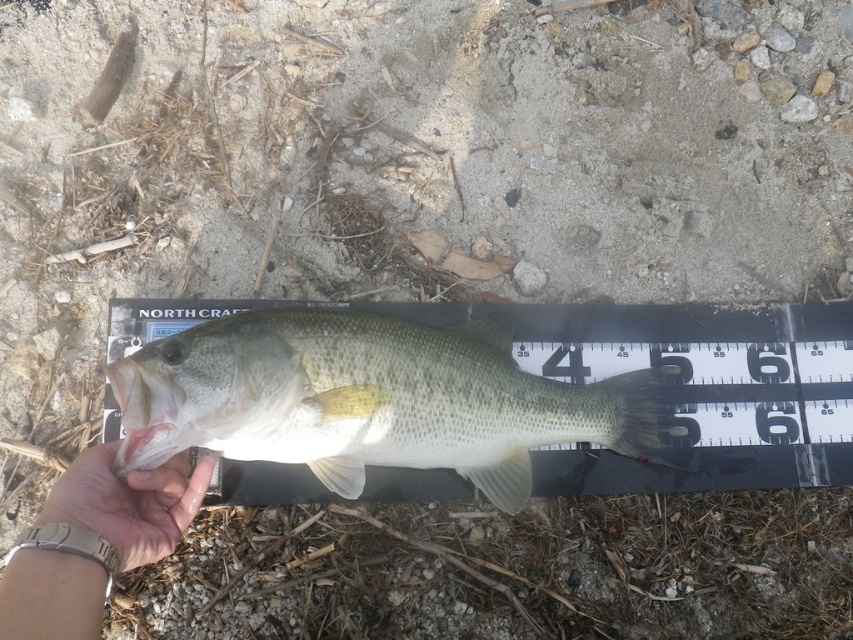
You are a fisherman who wants to know if the green matte fish at center can be placed on a table next to the satin gold watch at lower left without overlapping. Based on their widths, can the fish and the watch fit side by side on the table?

The green matte fish at center is wider than the satin gold watch at lower left, so they can fit side by side on the table as long as the total width of both items does not exceed the table surface.

You are a fisherman who just caught a fish and wants to know if it will fit in your 6 inch tall fish tank. You see the green matte fish at center and the satin gold watch at lower left. Which object is taller?

The green matte fish at center is much taller than the satin gold watch at lower left, so it will not fit in a 6 inch tall fish tank.

You are a fisherman who just caught a green matte fish at center. You notice a satin gold watch at lower left on your wrist. Based on the scene, can you determine the position of the fish relative to your watch?

The green matte fish at center is to the right of the satin gold watch at lower left, so the fish is positioned to the right of your watch.